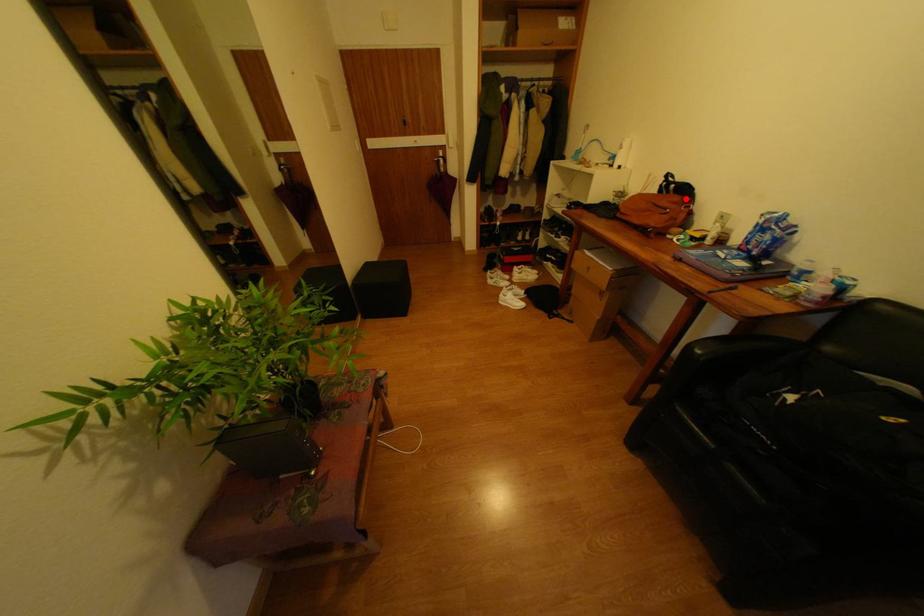
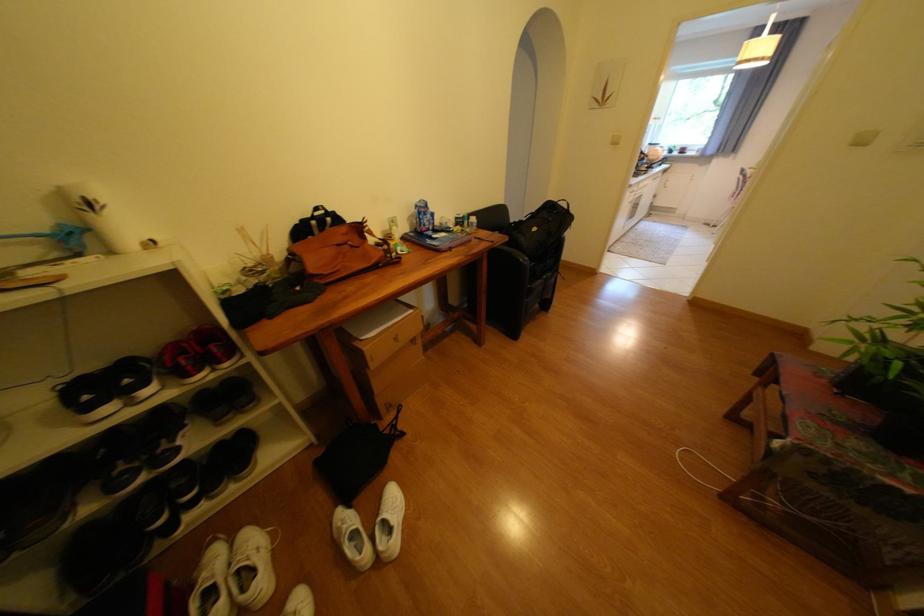
In the second image, find the point that corresponds to the highlighted location in the first image.

(351, 229)